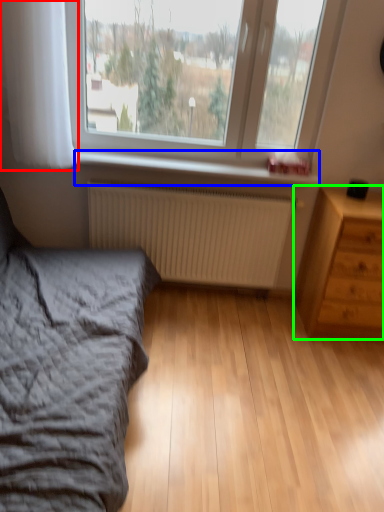
Question: Which object is positioned closest to curtain (highlighted by a red box)? Select from window sill (highlighted by a blue box) and chest of drawers (highlighted by a green box).

Choices:
 (A) window sill
 (B) chest of drawers

Answer: (A)